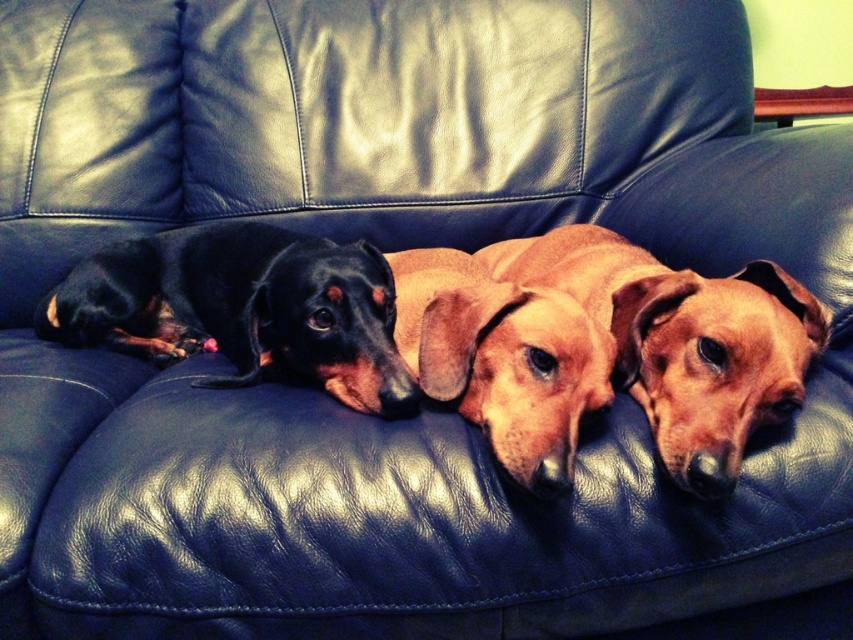
Can you confirm if brown matte dog at center is positioned to the left of black smooth dachshund at left?

Incorrect, brown matte dog at center is not on the left side of black smooth dachshund at left.

Is brown matte dog at center positioned at the back of black smooth dachshund at left?

No, it is not.

Image resolution: width=853 pixels, height=640 pixels. What do you see at coordinates (637, 337) in the screenshot?
I see `brown matte dog at center` at bounding box center [637, 337].

Image resolution: width=853 pixels, height=640 pixels. Identify the location of brown matte dog at center. (637, 337).